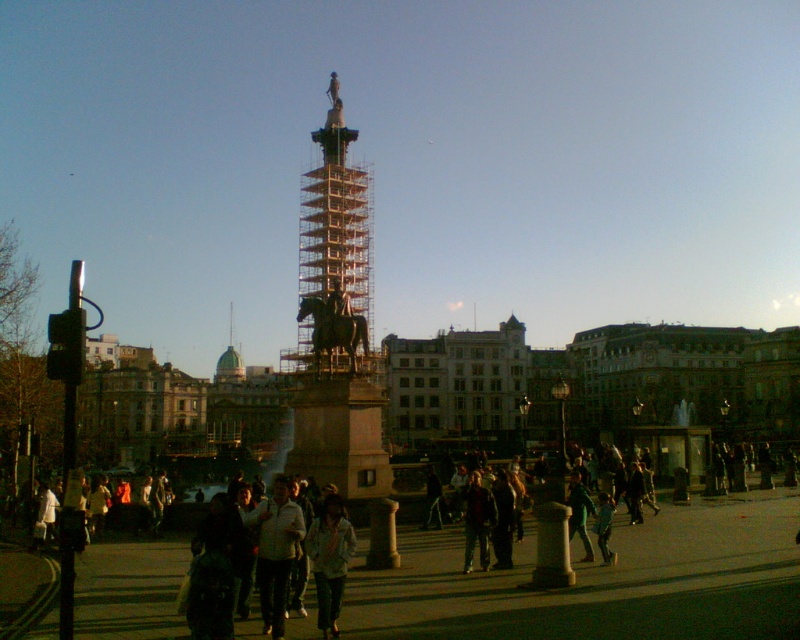
Question: Does dark gray jacket at lower center have a lesser width compared to light blue denim jacket at center?

Choices:
 (A) yes
 (B) no

Answer: (B)

Question: Can you confirm if dark gray jacket at center is positioned to the right of dark blue jeans at lower center?

Choices:
 (A) no
 (B) yes

Answer: (A)

Question: Estimate the real-world distances between objects in this image. Which object is farther from the dark gray jacket at lower center?

Choices:
 (A) dark gray jacket at center
 (B) light blue denim jacket at center
 (C) dark blue jeans at lower center

Answer: (C)

Question: Can you confirm if scaffolding metal tower at center is positioned above light blue denim jacket at center?

Choices:
 (A) yes
 (B) no

Answer: (A)

Question: Which object is positioned closest to the dark blue jeans at lower center?

Choices:
 (A) white cotton jacket at lower center
 (B) scaffolding metal tower at center
 (C) dark gray jacket at center

Answer: (C)

Question: Estimate the real-world distances between objects in this image. Which object is closer to the white cotton jacket at lower center?

Choices:
 (A) scaffolding metal tower at center
 (B) green dome at center
 (C) dark gray jacket at center
 (D) dark blue jeans at lower center

Answer: (C)